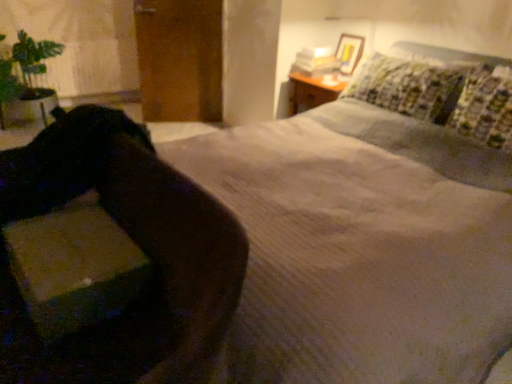
In order to face green leafy plant at left, should I rotate leftwards or rightwards?

You should rotate left by 28.077 degrees.

This screenshot has height=384, width=512. I want to click on matte cardboard box at lower left, so click(x=74, y=268).

This screenshot has height=384, width=512. I want to click on velvet-like brown swivel chair at lower left, so click(x=136, y=243).

Where is `green leafy plant at left`? The image size is (512, 384). green leafy plant at left is located at coordinates (26, 81).

Which is in front, point (129, 241) or point (7, 88)?

Point (129, 241)

Is matte cardboard box at lower left to the left of green leafy plant at left from the viewer's perspective?

Incorrect, matte cardboard box at lower left is not on the left side of green leafy plant at left.

Is matte cardboard box at lower left positioned far away from green leafy plant at left?

Yes, matte cardboard box at lower left is far from green leafy plant at left.

Between matte cardboard box at lower left and green leafy plant at left, which one has larger size?

Bigger between the two is green leafy plant at left.

Looking at this image, which is in front, velvet-like brown swivel chair at lower left or matte cardboard box at lower left?

Positioned in front is velvet-like brown swivel chair at lower left.

Find the location of a particular element. Image resolution: width=512 pixels, height=384 pixels. swivel chair on the left of the matte cardboard box at lower left is located at coordinates (136, 243).

Considering the relative positions of velvet-like brown swivel chair at lower left and matte cardboard box at lower left in the image provided, is velvet-like brown swivel chair at lower left to the left or to the right of matte cardboard box at lower left?

Based on their positions, velvet-like brown swivel chair at lower left is located to the left of matte cardboard box at lower left.

In terms of height, does velvet-like brown swivel chair at lower left look taller or shorter compared to matte cardboard box at lower left?

Considering their sizes, velvet-like brown swivel chair at lower left has more height than matte cardboard box at lower left.

From a real-world perspective, is green leafy plant at left beneath matte cardboard box at lower left?

Yes, from a real-world perspective, green leafy plant at left is under matte cardboard box at lower left.

Does green leafy plant at left have a greater width compared to matte cardboard box at lower left?

Correct, the width of green leafy plant at left exceeds that of matte cardboard box at lower left.

Is green leafy plant at left oriented towards matte cardboard box at lower left?

Yes, green leafy plant at left is aimed at matte cardboard box at lower left.

Based on the photo, considering the relative sizes of green leafy plant at left and matte cardboard box at lower left in the image provided, is green leafy plant at left taller than matte cardboard box at lower left?

Correct, green leafy plant at left is much taller as matte cardboard box at lower left.

From a real-world perspective, between matte cardboard box at lower left and velvet-like brown swivel chair at lower left, who is vertically higher?

matte cardboard box at lower left is physically above.

Does matte cardboard box at lower left come behind velvet-like brown swivel chair at lower left?

Yes, it is.

In the scene shown: Is matte cardboard box at lower left facing away from velvet-like brown swivel chair at lower left?

Correct, matte cardboard box at lower left is looking away from velvet-like brown swivel chair at lower left.

Which of these two, matte cardboard box at lower left or velvet-like brown swivel chair at lower left, is thinner?

matte cardboard box at lower left.

Between green leafy plant at left and velvet-like brown swivel chair at lower left, which one is positioned behind?

green leafy plant at left is more distant.

Based on their positions, is green leafy plant at left located to the left or right of velvet-like brown swivel chair at lower left?

green leafy plant at left is to the left of velvet-like brown swivel chair at lower left.

Does green leafy plant at left have a larger size compared to velvet-like brown swivel chair at lower left?

No, green leafy plant at left is not bigger than velvet-like brown swivel chair at lower left.

Which is behind, point (146, 226) or point (47, 45)?

Point (47, 45)

Between velvet-like brown swivel chair at lower left and green leafy plant at left, which one has more height?

Standing taller between the two is green leafy plant at left.

In terms of width, does velvet-like brown swivel chair at lower left look wider or thinner when compared to green leafy plant at left?

Clearly, velvet-like brown swivel chair at lower left has less width compared to green leafy plant at left.

Is velvet-like brown swivel chair at lower left not close to green leafy plant at left?

Indeed, velvet-like brown swivel chair at lower left is not near green leafy plant at left.

What are the coordinates of `houseplant behind the matte cardboard box at lower left` in the screenshot? It's located at (26, 81).

Where is `cardboard box that appears above the velvet-like brown swivel chair at lower left (from a real-world perspective)`? Image resolution: width=512 pixels, height=384 pixels. cardboard box that appears above the velvet-like brown swivel chair at lower left (from a real-world perspective) is located at coordinates (74, 268).

Considering their positions, is velvet-like brown swivel chair at lower left positioned further to green leafy plant at left than matte cardboard box at lower left?

Based on the image, matte cardboard box at lower left appears to be further to green leafy plant at left.

From the image, which object appears to be farther from velvet-like brown swivel chair at lower left, green leafy plant at left or matte cardboard box at lower left?

The object further to velvet-like brown swivel chair at lower left is green leafy plant at left.

From the image, which object appears to be farther from velvet-like brown swivel chair at lower left, matte cardboard box at lower left or green leafy plant at left?

green leafy plant at left.

Considering their positions, is velvet-like brown swivel chair at lower left positioned further to matte cardboard box at lower left than green leafy plant at left?

green leafy plant at left lies further to matte cardboard box at lower left than the other object.

From the picture: Looking at the image, which one is located further to matte cardboard box at lower left, green leafy plant at left or velvet-like brown swivel chair at lower left?

green leafy plant at left is positioned further to the anchor matte cardboard box at lower left.

When comparing their distances from green leafy plant at left, does matte cardboard box at lower left or velvet-like brown swivel chair at lower left seem closer?

velvet-like brown swivel chair at lower left is closer to green leafy plant at left.

The height and width of the screenshot is (384, 512). Identify the location of cardboard box between velvet-like brown swivel chair at lower left and green leafy plant at left in the front-back direction. (74, 268).